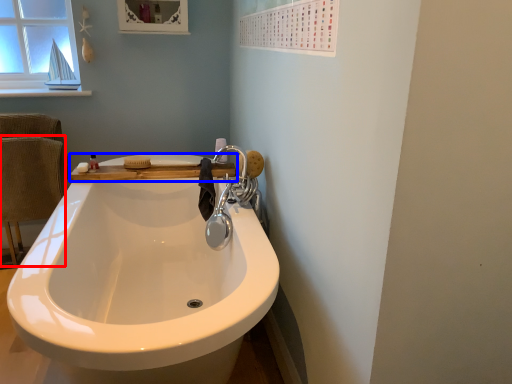
Question: Which object appears farthest to the camera in this image, armchair (highlighted by a red box) or counter top (highlighted by a blue box)?

Choices:
 (A) armchair
 (B) counter top

Answer: (A)